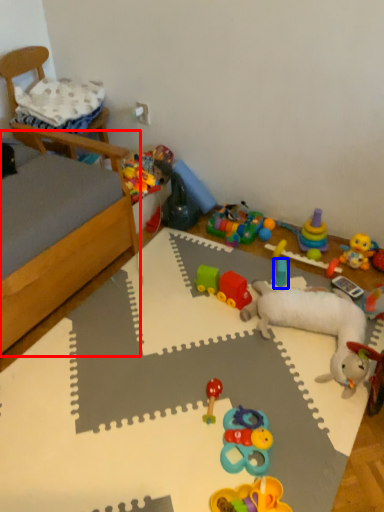
Question: Which object is closer to the camera taking this photo, bed frame (highlighted by a red box) or toy (highlighted by a blue box)?

Choices:
 (A) bed frame
 (B) toy

Answer: (A)